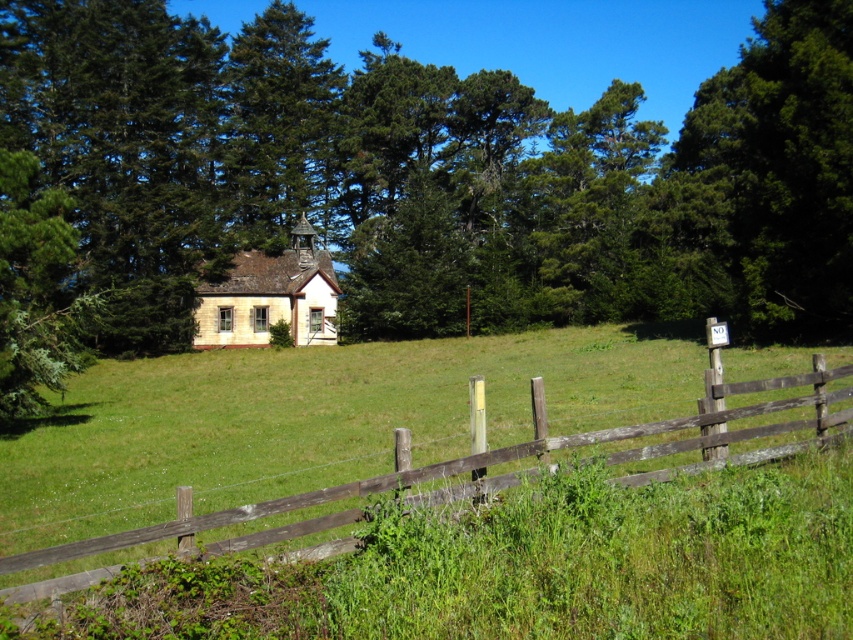
Does green leafy tree at center have a lesser width compared to yellow stone church at center?

No, green leafy tree at center is not thinner than yellow stone church at center.

Which is more to the right, green leafy tree at center or yellow stone church at center?

green leafy tree at center

You are a GUI agent. You are given a task and a screenshot of the screen. Output one action in this format:
    pyautogui.click(x=<x>, y=<y>)
    Task: Click on the green leafy tree at center
    The height and width of the screenshot is (640, 853).
    Given the screenshot: What is the action you would take?
    pyautogui.click(x=434, y=176)

This screenshot has width=853, height=640. In order to click on green leafy tree at center in this screenshot , I will do `click(434, 176)`.

Consider the image. Does brown wooden fence at center have a lesser width compared to green leafy tree at upper right?

No.

Is brown wooden fence at center shorter than green leafy tree at upper right?

Yes.

Find the location of a particular element. brown wooden fence at center is located at coordinates (306, 419).

At what (x,y) coordinates should I click in order to perform the action: click on brown wooden fence at center. Please return your answer as a coordinate pair (x, y). This screenshot has width=853, height=640. Looking at the image, I should click on (306, 419).

How distant is green leafy tree at center from brown wooden fence at center?

The distance of green leafy tree at center from brown wooden fence at center is 53.57 feet.

Based on the photo, can you confirm if green leafy tree at center is positioned above brown wooden fence at center?

Indeed, green leafy tree at center is positioned over brown wooden fence at center.

Does point (666, 154) come in front of point (277, 486)?

That is False.

Locate an element on the screen. This screenshot has width=853, height=640. green leafy tree at center is located at coordinates (434, 176).